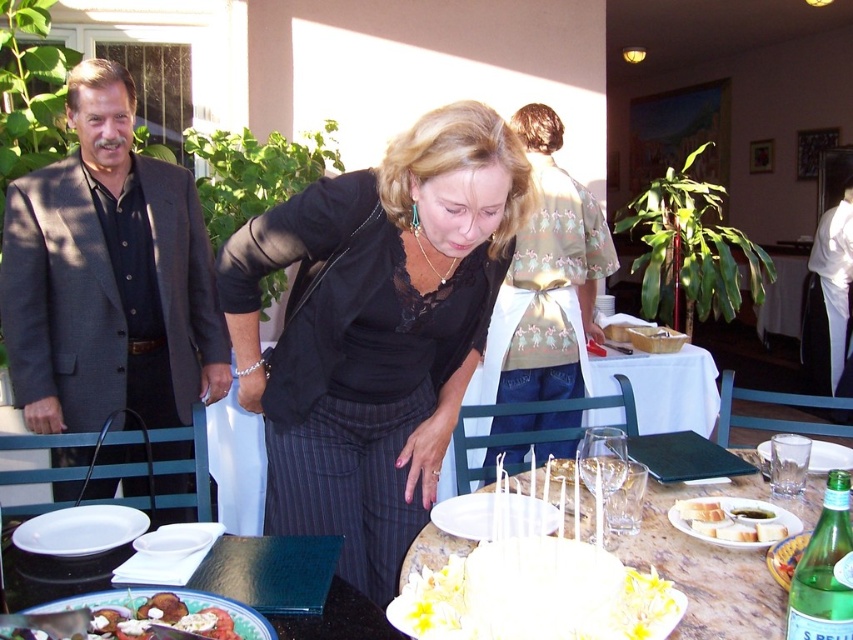
Question: Considering the real-world distances, which object is closest to the white matte plate at lower left?

Choices:
 (A) white bread at table
 (B) dark gray suit at left
 (C) white frosted cake at center

Answer: (C)

Question: From the image, what is the correct spatial relationship of white frosted cake at center in relation to white paper plate at lower center?

Choices:
 (A) right
 (B) left

Answer: (B)

Question: Which point appears closest to the camera in this image?

Choices:
 (A) (526, 269)
 (B) (708, 499)
 (C) (740, 516)
 (D) (402, 168)

Answer: (D)

Question: Is white matte plate at lower left smaller than green glass bottle at center?

Choices:
 (A) no
 (B) yes

Answer: (A)

Question: Which of the following is the closest to the observer?

Choices:
 (A) transparent glass at table right
 (B) matte gold blouse at center
 (C) white cake at center
 (D) green glossy plate at lower left

Answer: (D)

Question: Does matte ceramic plate at lower left have a greater width compared to clear glass plate at center?

Choices:
 (A) no
 (B) yes

Answer: (A)